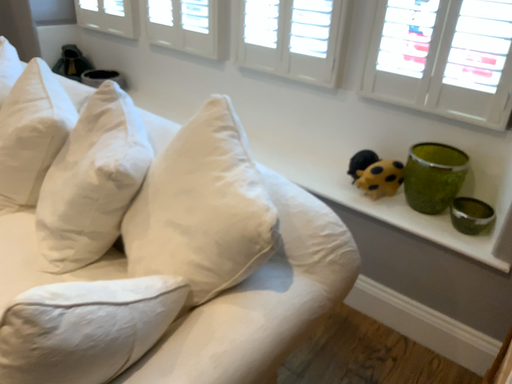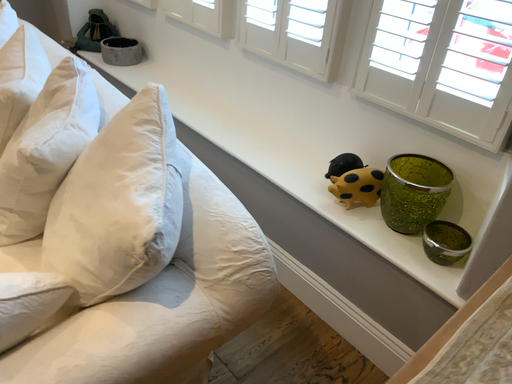
Question: Which way did the camera rotate in the video?

Choices:
 (A) rotated right
 (B) rotated left

Answer: (B)